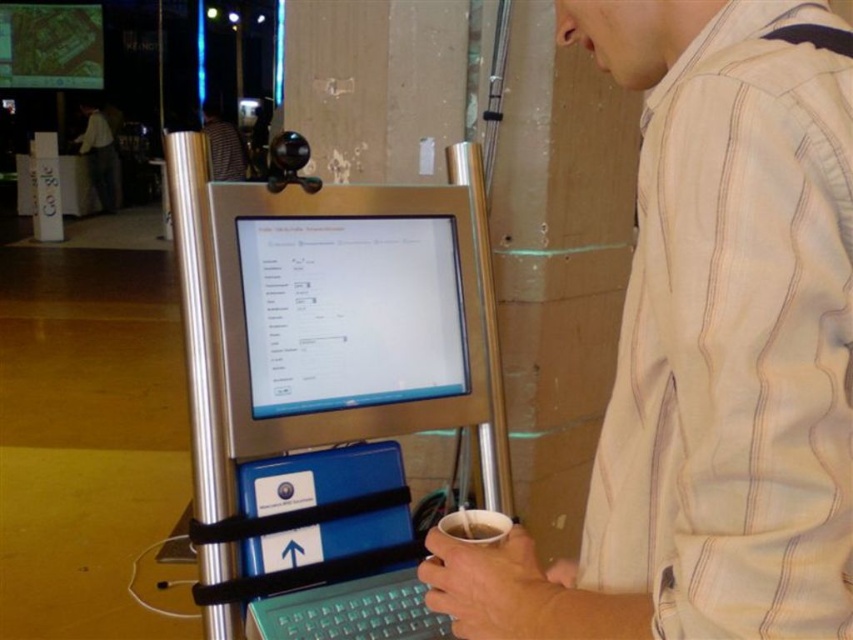
You are a person standing at the camera position. You want to place your disposable cup with a straw on the blue tray with a white label. The blue tray with a white label is located at point (408, 608). Can you reach the blue tray with a white label from your current position without moving your feet?

The point (408, 608) and camera are 1.02 meters apart. Since the average person can reach about 1 meter without moving their feet, the distance is slightly beyond reach. You may need to step forward or extend your arm further.